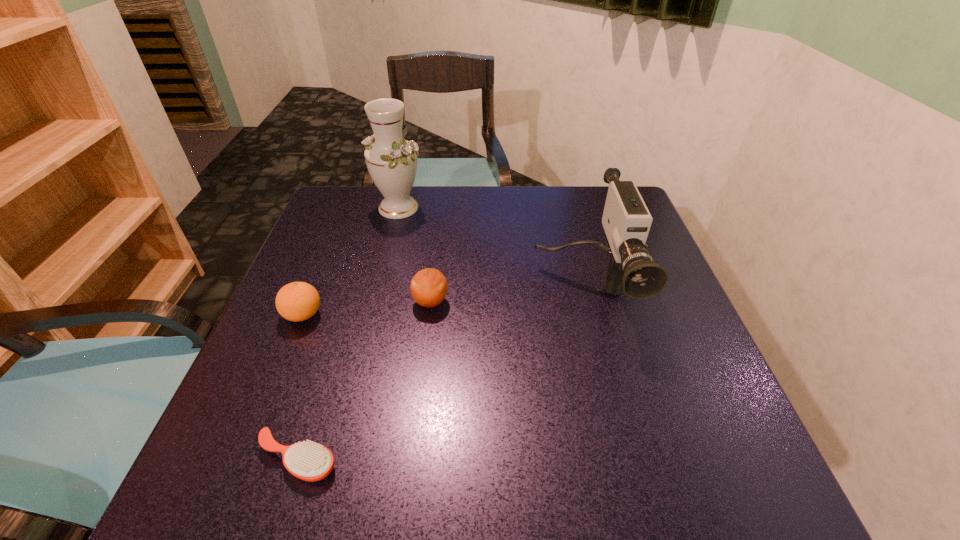
You are a GUI agent. You are given a task and a screenshot of the screen. Output one action in this format:
    pyautogui.click(x=<x>, y=<y>)
    Task: Click on the object that is positioned at the near left corner
    The width and height of the screenshot is (960, 540).
    Given the screenshot: What is the action you would take?
    pyautogui.click(x=309, y=461)

Locate an element on the screen. vacant area at the far edge of the desktop is located at coordinates (575, 224).

At what (x,y) coordinates should I click in order to perform the action: click on blank space at the near edge of the desktop. Please return your answer as a coordinate pair (x, y). Image resolution: width=960 pixels, height=540 pixels. Looking at the image, I should click on tap(318, 482).

Find the location of a particular element. This screenshot has height=540, width=960. free space at the left edge is located at coordinates (358, 248).

I want to click on vacant area at the right edge of the desktop, so click(x=636, y=319).

The image size is (960, 540). What are the coordinates of `free spot at the far left corner of the desktop` in the screenshot? It's located at (359, 219).

This screenshot has width=960, height=540. What are the coordinates of `free space at the near right corner of the desktop` in the screenshot? It's located at (698, 477).

Where is `free space that is in between the tallest object and the second tallest object`? This screenshot has height=540, width=960. free space that is in between the tallest object and the second tallest object is located at coordinates (491, 249).

The width and height of the screenshot is (960, 540). In order to click on vacant area between the left orange and the rightmost object in this screenshot , I will do `click(443, 302)`.

Where is `vacant space in between the farthest object and the second object from right to left`? This screenshot has height=540, width=960. vacant space in between the farthest object and the second object from right to left is located at coordinates (415, 255).